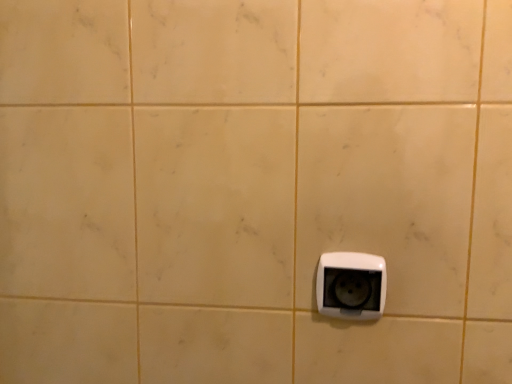
Measure the distance between point (x=324, y=303) and camera.

They are 20.55 inches apart.

What do you see at coordinates (351, 285) in the screenshot? The image size is (512, 384). I see `white plastic socket at lower right` at bounding box center [351, 285].

You are a GUI agent. You are given a task and a screenshot of the screen. Output one action in this format:
    pyautogui.click(x=<x>, y=<y>)
    Task: Click on the white plastic socket at lower right
    
    Given the screenshot: What is the action you would take?
    [351, 285]

This screenshot has height=384, width=512. What are the coordinates of `white plastic socket at lower right` in the screenshot? It's located at (351, 285).